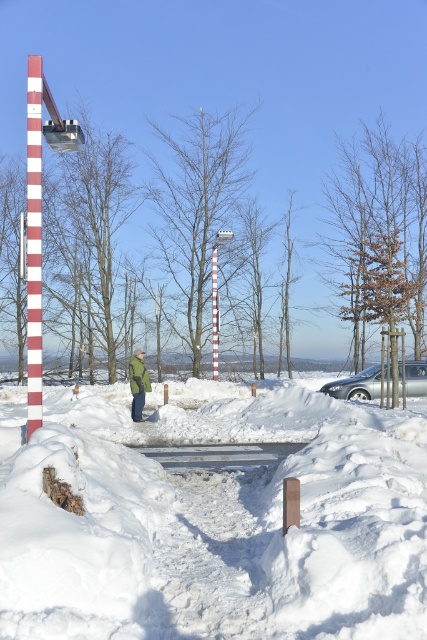
Question: Which object is the farthest from the silver metallic car at right?

Choices:
 (A) white striped pole at center
 (B) red striped pole at center
 (C) white fluffy snow at center

Answer: (A)

Question: Is silver metallic car at right positioned before green matte jacket at center?

Choices:
 (A) no
 (B) yes

Answer: (A)

Question: Does white fluffy snow at center appear under silver metallic car at right?

Choices:
 (A) yes
 (B) no

Answer: (A)

Question: Which is farther from the red striped pole at center?

Choices:
 (A) silver metallic car at right
 (B) white fluffy snow at center
 (C) green matte jacket at center

Answer: (B)

Question: Which of these objects is positioned farthest from the white striped pole at center?

Choices:
 (A) red striped pole at center
 (B) white fluffy snow at center
 (C) silver metallic car at right
 (D) green matte jacket at center

Answer: (A)

Question: Observing the image, what is the correct spatial positioning of silver metallic car at right in reference to red striped pole at center?

Choices:
 (A) left
 (B) right

Answer: (B)